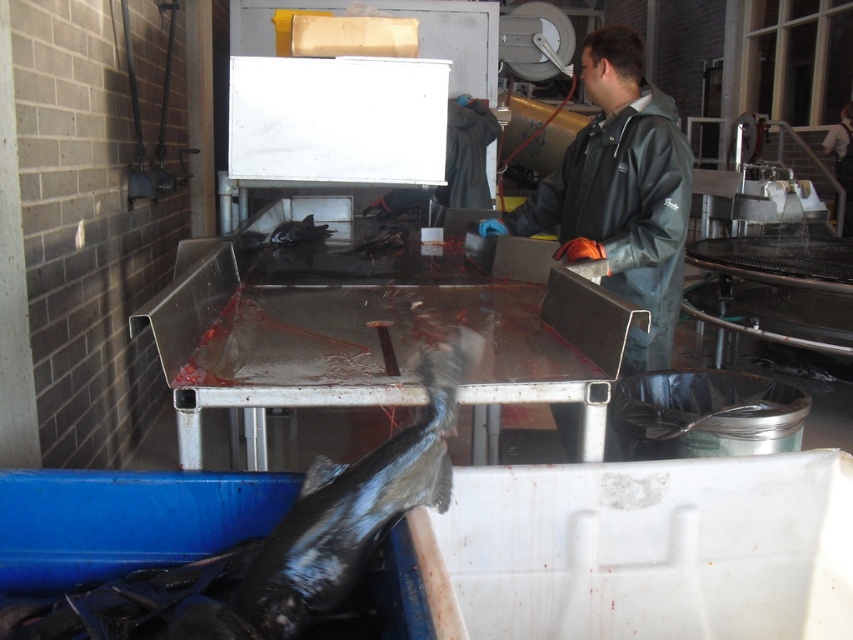
Question: Which object appears closest to the camera in this image?

Choices:
 (A) shiny black fish at lower left
 (B) black leather jacket at center

Answer: (A)

Question: Among these points, which one is nearest to the camera?

Choices:
 (A) (490, 225)
 (B) (393, 465)

Answer: (B)

Question: Is black leather jacket at center in front of shiny black fish at lower left?

Choices:
 (A) no
 (B) yes

Answer: (A)

Question: Is black leather jacket at center further to the viewer compared to shiny black fish at lower left?

Choices:
 (A) no
 (B) yes

Answer: (B)

Question: Considering the relative positions of black leather jacket at center and shiny black fish at lower left in the image provided, where is black leather jacket at center located with respect to shiny black fish at lower left?

Choices:
 (A) right
 (B) left

Answer: (A)

Question: Which of the following is the closest to the observer?

Choices:
 (A) (358, 538)
 (B) (602, 192)

Answer: (A)